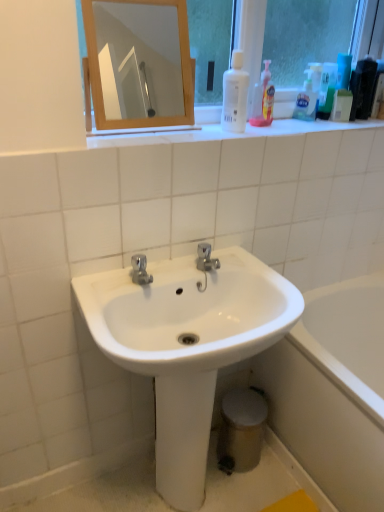
This screenshot has height=512, width=384. Describe the element at coordinates (306, 100) in the screenshot. I see `translucent plastic soap dispenser at upper right, the first cleaning product viewed from the right` at that location.

Describe the element at coordinates (263, 100) in the screenshot. I see `translucent plastic bottle at upper right, which is the 2th cleaning product from right to left` at that location.

The width and height of the screenshot is (384, 512). What do you see at coordinates (139, 60) in the screenshot?
I see `wooden mirror at upper center` at bounding box center [139, 60].

In the scene shown: What is the approximate width of white glossy bathtub at lower right?

The width of white glossy bathtub at lower right is 70.84 centimeters.

In order to click on white glossy bottle at upper center, which is the first cleaning product in left-to-right order in this screenshot , I will do click(235, 95).

Could you tell me if wooden mirror at upper center is facing translucent plastic bottle at upper right, which is the 2th cleaning product from right to left?

No, wooden mirror at upper center is not oriented towards translucent plastic bottle at upper right, which is the 2th cleaning product from right to left.

How different are the orientations of wooden mirror at upper center and translucent plastic bottle at upper right, which is the 2th cleaning product from right to left, in degrees?

There is a 1.19-degree angle between the facing directions of wooden mirror at upper center and translucent plastic bottle at upper right, which is the 2th cleaning product from right to left.

Is wooden mirror at upper center positioned far away from translucent plastic bottle at upper right, which is the 2th cleaning product from right to left?

Yes, wooden mirror at upper center is far from translucent plastic bottle at upper right, which is the 2th cleaning product from right to left.

Is translucent plastic bottle at upper right, which is the 2th cleaning product from right to left, surrounded by wooden mirror at upper center?

Actually, translucent plastic bottle at upper right, which is the 2th cleaning product from right to left, is outside wooden mirror at upper center.

Find the location of a particular element. The width and height of the screenshot is (384, 512). mirror above the white glossy bottle at upper center, the third cleaning product from the right (from a real-world perspective) is located at coordinates (139, 60).

Which point is more distant from viewer, (114,58) or (240,115)?

Positioned behind is point (114,58).

From the picture: Which is behind, wooden mirror at upper center or white glossy bottle at upper center, the third cleaning product from the right?

Positioned behind is white glossy bottle at upper center, the third cleaning product from the right.

How much distance is there between white glossy bottle at upper center, the third cleaning product from the right, and white glossy sink at center?

white glossy bottle at upper center, the third cleaning product from the right, and white glossy sink at center are 25.76 inches apart from each other.

Looking at this image, does white glossy bottle at upper center, which is the first cleaning product in left-to-right order, have a smaller size compared to white glossy sink at center?

Yes, white glossy bottle at upper center, which is the first cleaning product in left-to-right order, is smaller than white glossy sink at center.

From a real-world perspective, which is physically above, white glossy bottle at upper center, the third cleaning product from the right, or white glossy sink at center?

In real-world perspective, white glossy bottle at upper center, the third cleaning product from the right, is above.

Looking at this image, which of these two, white glossy bottle at upper center, the third cleaning product from the right, or white glossy sink at center, stands shorter?

white glossy bottle at upper center, the third cleaning product from the right, is shorter.

Is white glossy sink at center turned away from translucent plastic soap dispenser at upper right, the first cleaning product viewed from the right?

white glossy sink at center is not turned away from translucent plastic soap dispenser at upper right, the first cleaning product viewed from the right.

Is white glossy sink at center wider or thinner than translucent plastic soap dispenser at upper right, the first cleaning product viewed from the right?

In the image, white glossy sink at center appears to be wider than translucent plastic soap dispenser at upper right, the first cleaning product viewed from the right.

Does white glossy sink at center appear on the left side of translucent plastic soap dispenser at upper right, the first cleaning product viewed from the right?

Yes, white glossy sink at center is to the left of translucent plastic soap dispenser at upper right, the first cleaning product viewed from the right.

In order to click on the 3rd cleaning product behind the white glossy sink at center, starting your count from the anchor in this screenshot , I will do `click(306, 100)`.

Between point (192, 494) and point (367, 402), which one is positioned in front?

The point (367, 402) is closer.

From the picture: Is white glossy sink at center outside of white glossy bathtub at lower right?

white glossy sink at center is positioned outside white glossy bathtub at lower right.

Considering the relative positions of white glossy sink at center and white glossy bathtub at lower right in the image provided, is white glossy sink at center to the left of white glossy bathtub at lower right from the viewer's perspective?

Correct, you'll find white glossy sink at center to the left of white glossy bathtub at lower right.

Which of these two, white glossy sink at center or white glossy bathtub at lower right, is bigger?

white glossy bathtub at lower right.

Which of these two, translucent plastic bottle at upper right, which is the 2th cleaning product from left to right, or translucent plastic soap dispenser at upper right, the first cleaning product viewed from the right, is bigger?

Answer: With larger size is translucent plastic bottle at upper right, which is the 2th cleaning product from left to right.

You are a GUI agent. You are given a task and a screenshot of the screen. Output one action in this format:
    pyautogui.click(x=<x>, y=<y>)
    Task: Click on the 1st cleaning product positioned below the translucent plastic soap dispenser at upper right, the first cleaning product viewed from the right (from the image's perspective)
    The image size is (384, 512).
    Given the screenshot: What is the action you would take?
    pyautogui.click(x=263, y=100)

From a real-world perspective, between translucent plastic bottle at upper right, which is the 2th cleaning product from left to right, and translucent plastic soap dispenser at upper right, which ranks as the 3th cleaning product in left-to-right order, who is vertically higher?

In real-world perspective, translucent plastic bottle at upper right, which is the 2th cleaning product from left to right, is above.

Can you confirm if translucent plastic bottle at upper right, which is the 2th cleaning product from left to right, is wider than translucent plastic soap dispenser at upper right, the first cleaning product viewed from the right?

Yes.

From the picture: Does wooden mirror at upper center have a lesser height compared to white glossy bathtub at lower right?

Yes, wooden mirror at upper center is shorter than white glossy bathtub at lower right.

From the image's perspective, does wooden mirror at upper center appear lower than white glossy bathtub at lower right?

No, from the image's perspective, wooden mirror at upper center is not below white glossy bathtub at lower right.

Considering the positions of objects wooden mirror at upper center and white glossy bathtub at lower right in the image provided, who is more to the right, wooden mirror at upper center or white glossy bathtub at lower right?

From the viewer's perspective, white glossy bathtub at lower right appears more on the right side.

Identify the location of bathtub located underneath the wooden mirror at upper center (from a real-world perspective). This screenshot has width=384, height=512. (333, 391).

Identify the location of mirror in front of the translucent plastic bottle at upper right, which is the 2th cleaning product from right to left. Image resolution: width=384 pixels, height=512 pixels. (139, 60).

I want to click on cleaning product that is the 1st one when counting backward from the wooden mirror at upper center, so click(235, 95).

Looking at the image, which one is located further to white glossy bottle at upper center, which is the first cleaning product in left-to-right order, wooden mirror at upper center or white glossy bathtub at lower right?

Among the two, wooden mirror at upper center is located further to white glossy bottle at upper center, which is the first cleaning product in left-to-right order.

Based on their spatial positions, is white glossy sink at center or white glossy bathtub at lower right further from wooden mirror at upper center?

The object further to wooden mirror at upper center is white glossy bathtub at lower right.

Which object lies nearer to the anchor point white glossy bathtub at lower right, translucent plastic soap dispenser at upper right, the first cleaning product viewed from the right, or white glossy sink at center?

white glossy sink at center lies closer to white glossy bathtub at lower right than the other object.

Based on their spatial positions, is white glossy bathtub at lower right or translucent plastic bottle at upper right, which is the 2th cleaning product from right to left, further from translucent plastic soap dispenser at upper right, the first cleaning product viewed from the right?

white glossy bathtub at lower right lies further to translucent plastic soap dispenser at upper right, the first cleaning product viewed from the right, than the other object.

From the image, which object appears to be nearer to white glossy sink at center, translucent plastic soap dispenser at upper right, which ranks as the 3th cleaning product in left-to-right order, or wooden mirror at upper center?

translucent plastic soap dispenser at upper right, which ranks as the 3th cleaning product in left-to-right order, is positioned closer to the anchor white glossy sink at center.

Considering their positions, is translucent plastic soap dispenser at upper right, the first cleaning product viewed from the right, positioned closer to translucent plastic bottle at upper right, which is the 2th cleaning product from left to right, than wooden mirror at upper center?

translucent plastic soap dispenser at upper right, the first cleaning product viewed from the right, is closer to translucent plastic bottle at upper right, which is the 2th cleaning product from left to right.

Looking at the image, which one is located further to white glossy sink at center, wooden mirror at upper center or translucent plastic bottle at upper right, which is the 2th cleaning product from right to left?

The object further to white glossy sink at center is wooden mirror at upper center.

From the image, which object appears to be farther from translucent plastic soap dispenser at upper right, the first cleaning product viewed from the right, wooden mirror at upper center or translucent plastic bottle at upper right, which is the 2th cleaning product from left to right?

The object further to translucent plastic soap dispenser at upper right, the first cleaning product viewed from the right, is wooden mirror at upper center.

Locate an element on the screen. The width and height of the screenshot is (384, 512). sink between translucent plastic bottle at upper right, which is the 2th cleaning product from left to right, and white glossy bathtub at lower right, in the vertical direction is located at coordinates (187, 345).

Locate an element on the screen. The width and height of the screenshot is (384, 512). sink between translucent plastic soap dispenser at upper right, which ranks as the 3th cleaning product in left-to-right order, and white glossy bathtub at lower right in the up-down direction is located at coordinates (187, 345).

The image size is (384, 512). I want to click on sink between wooden mirror at upper center and white glossy bathtub at lower right from top to bottom, so click(187, 345).

Image resolution: width=384 pixels, height=512 pixels. Identify the location of cleaning product that lies between translucent plastic bottle at upper right, which is the 2th cleaning product from left to right, and white glossy bathtub at lower right from top to bottom. (235, 95).